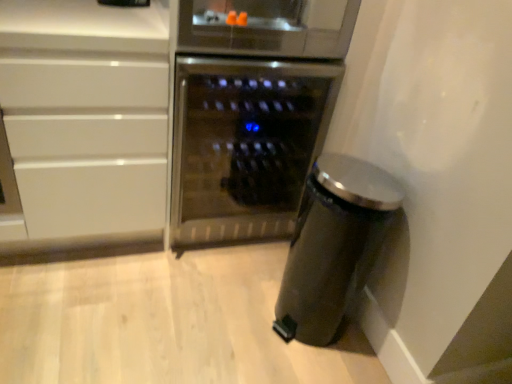
Find the location of a particular element. The image size is (512, 384). vacant space positioned to the left of satin black trash can at lower right is located at coordinates (232, 309).